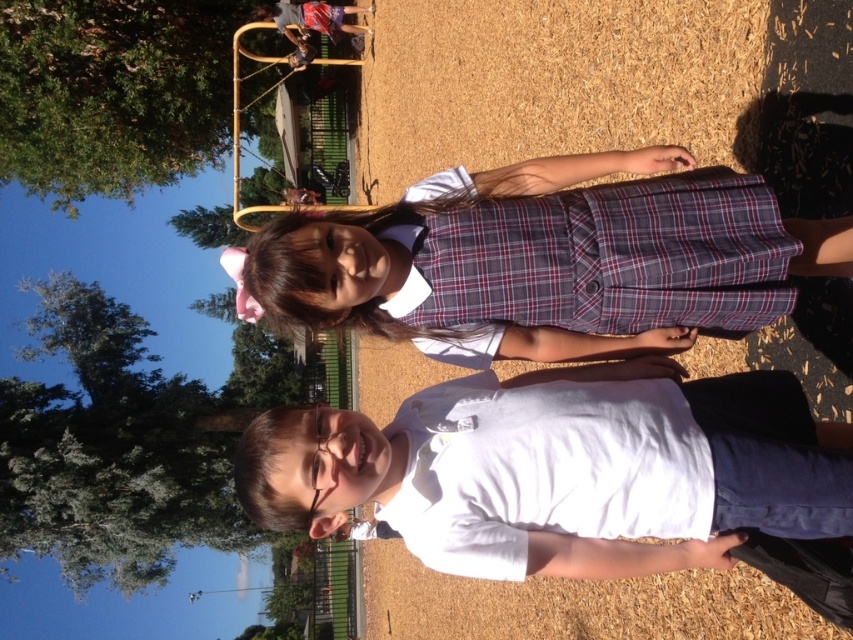
Can you confirm if white matte shirt at center is bigger than plaid fabric dress at center?

Yes, white matte shirt at center is bigger than plaid fabric dress at center.

What do you see at coordinates (556, 472) in the screenshot? The width and height of the screenshot is (853, 640). I see `white matte shirt at center` at bounding box center [556, 472].

Where is `white matte shirt at center`? white matte shirt at center is located at coordinates (556, 472).